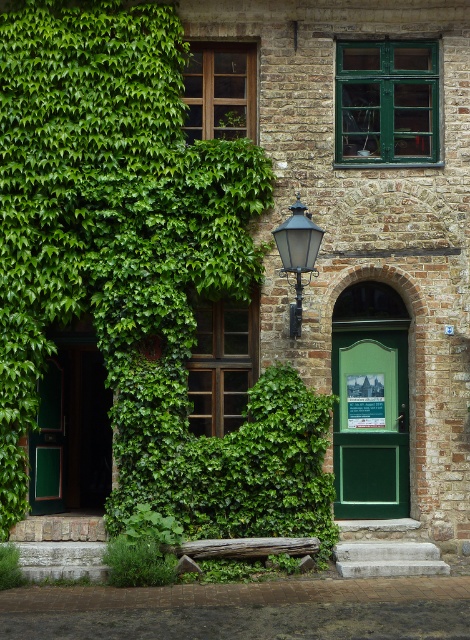
You are standing in front of a rustic building with ivy covering parts of it. You see a point at coordinates (47,444). What object does this point correspond to?

The point at coordinates (47,444) corresponds to the green matte door at left.

You are a painter hired to paint the green matte door at left and the green leafy plant at lower left. Which object requires more paint due to its size?

The green matte door at left requires more paint because it is larger in size than the green leafy plant at lower left.

You are standing in front of the rustic building and want to enter through the green matte door at left. To avoid getting wet from the rain, you notice the matte black lamp post at center provides shelter. Can you stand under the lamp post and still reach the door?

The green matte door at left is positioned under the matte black lamp post at center, so yes, you can stand under the lamp post and still reach the door because the door is located beneath its shelter.